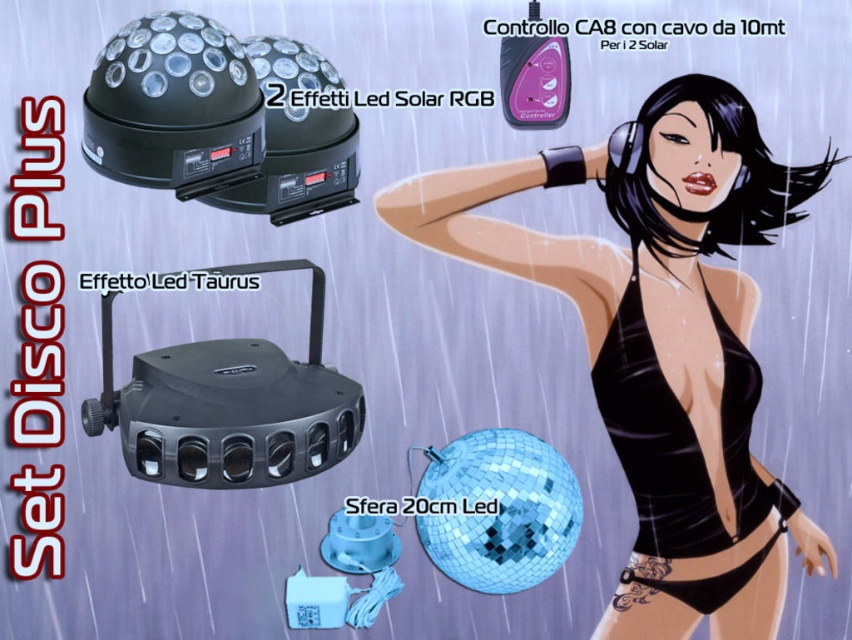
Question: Which is nearer to the shiny blue disco ball at center?

Choices:
 (A) black satin bikini top at right
 (B) black plastic effetto led taurus at center
 (C) black glossy swimsuit at center

Answer: (A)

Question: Is black plastic effetto led taurus at center below black satin bikini top at right?

Choices:
 (A) yes
 (B) no

Answer: (B)

Question: Is the position of black glossy swimsuit at center more distant than that of shiny blue disco ball at center?

Choices:
 (A) yes
 (B) no

Answer: (B)

Question: Which point is closer to the camera taking this photo?

Choices:
 (A) (321, 365)
 (B) (528, 516)
 (C) (720, 365)

Answer: (B)

Question: From the image, what is the correct spatial relationship of black glossy swimsuit at center in relation to shiny blue disco ball at center?

Choices:
 (A) left
 (B) right

Answer: (B)

Question: Which point appears closest to the camera in this image?

Choices:
 (A) (182, 273)
 (B) (767, 176)
 (C) (626, 396)

Answer: (A)